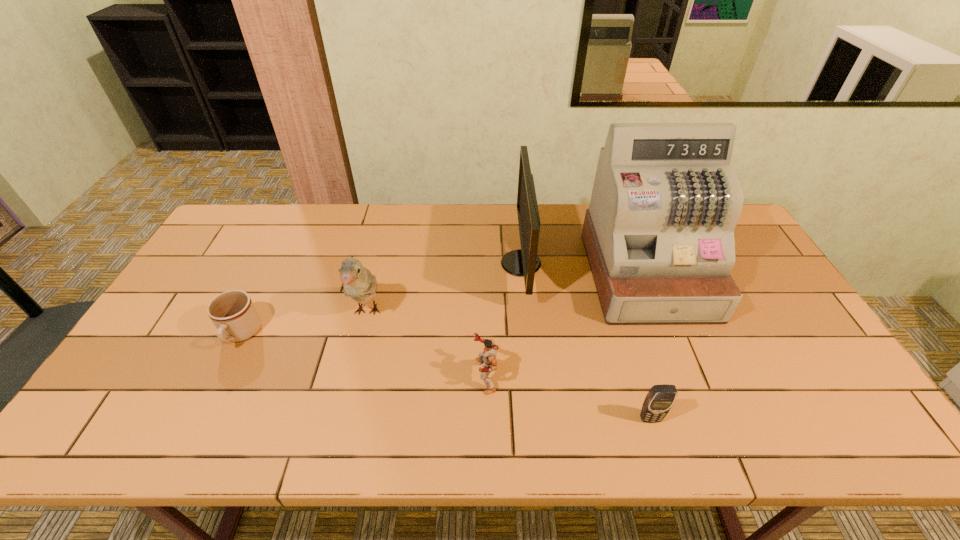
Locate an element on the screen. Image resolution: width=960 pixels, height=540 pixels. computer monitor present at the far edge is located at coordinates (524, 262).

Where is `object that is positioned at the near edge`? The height and width of the screenshot is (540, 960). object that is positioned at the near edge is located at coordinates (660, 398).

Image resolution: width=960 pixels, height=540 pixels. I want to click on free space at the far edge of the desktop, so click(451, 218).

This screenshot has width=960, height=540. In order to click on vacant space at the near edge of the desktop in this screenshot , I will do `click(578, 430)`.

This screenshot has height=540, width=960. I want to click on blank space at the left edge of the desktop, so click(x=219, y=264).

The image size is (960, 540). I want to click on blank space at the far left corner of the desktop, so click(252, 213).

At what (x,y) coordinates should I click in order to perform the action: click on free spot between the cellular telephone and the puncher. Please return your answer as a coordinate pair (x, y). The image size is (960, 540). Looking at the image, I should click on (567, 397).

Where is `free space that is in between the leftmost object and the puncher`? The image size is (960, 540). free space that is in between the leftmost object and the puncher is located at coordinates (363, 355).

Where is `free area in between the bird and the leftmost object`? The width and height of the screenshot is (960, 540). free area in between the bird and the leftmost object is located at coordinates (304, 323).

Identify the location of empty space between the fifth object from right to left and the tallest object. This screenshot has width=960, height=540. (507, 293).